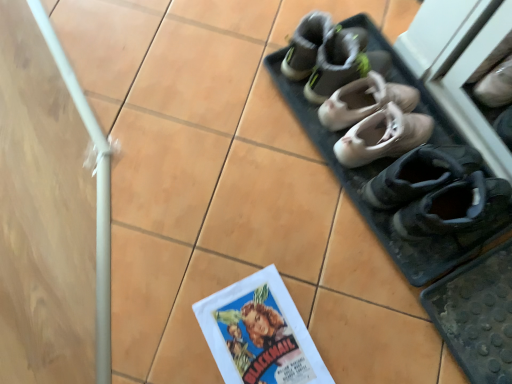
You are a GUI agent. You are given a task and a screenshot of the screen. Output one action in this format:
    pyautogui.click(x=<x>, y=<y>)
    Task: Click on the free space above matte paper comic book at lower center (from a real-world perspective)
    
    Given the screenshot: What is the action you would take?
    pyautogui.click(x=261, y=339)